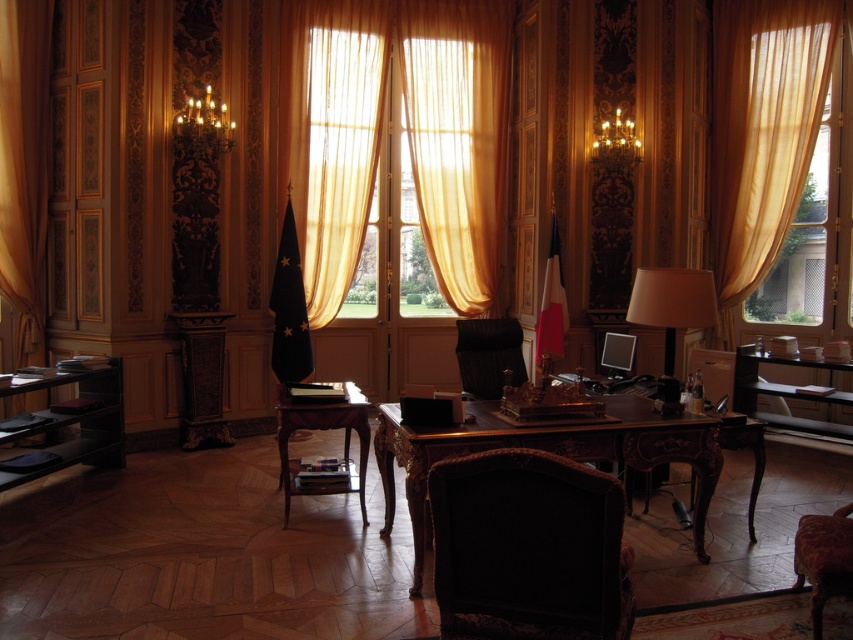
You are an office worker who needs to adjust the lighting in the room by moving closer to either the translucent gold curtain at center or the mahogany wood desk at center. Which object should you move toward to be closer to the window?

The translucent gold curtain at center is to the left of the mahogany wood desk at center, so moving toward the translucent gold curtain at center would bring you closer to the window since it is positioned nearer to the window area.

You are an office worker who needs to reach the window to adjust the translucent gold curtain at center. You are currently standing next to the wooden polished table at center. Which direction should you move to reach the curtain?

The translucent gold curtain at center is to the right of the wooden polished table at center, so you should move to the right to reach the curtain.

You are standing in the formal office and want to know the exact position of the translucent gold curtain at center. Can you tell me its 2D coordinates?

The translucent gold curtain at center is located at the 2D coordinates of point (408, 134).